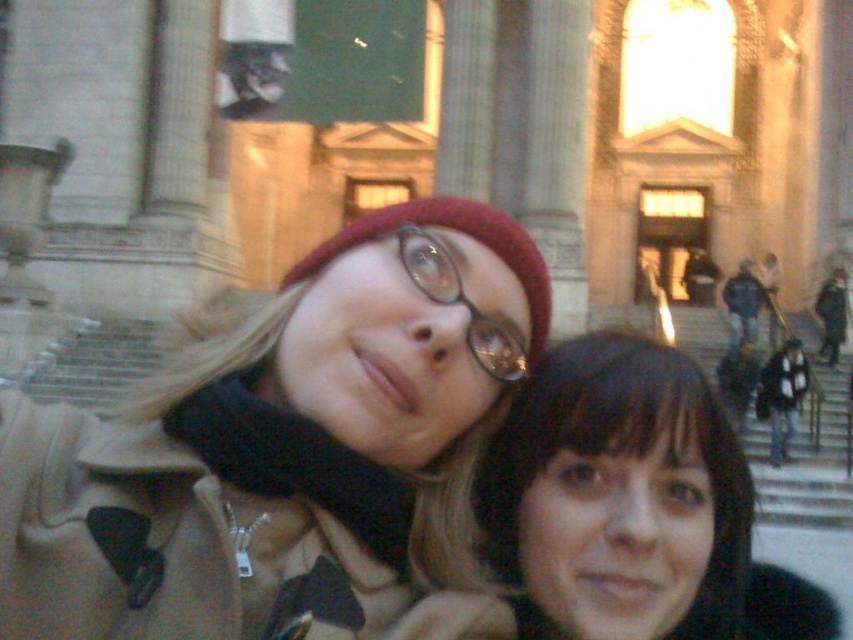
Question: Can you confirm if matte beige coat at center is positioned above clear plastic glasses at center?

Choices:
 (A) no
 (B) yes

Answer: (B)

Question: Among these objects, which one is nearest to the camera?

Choices:
 (A) clear plastic glasses at center
 (B) matte beige coat at center

Answer: (B)

Question: Which point is farther to the camera?

Choices:
 (A) (666, 413)
 (B) (242, 435)
 (C) (403, 259)

Answer: (C)

Question: Which object is the closest to the matte beige coat at center?

Choices:
 (A) black matte hair at lower right
 (B) clear plastic glasses at center

Answer: (A)

Question: Is the position of black matte hair at lower right more distant than that of clear plastic glasses at center?

Choices:
 (A) no
 (B) yes

Answer: (A)

Question: Is matte beige coat at center wider than black matte hair at lower right?

Choices:
 (A) no
 (B) yes

Answer: (B)